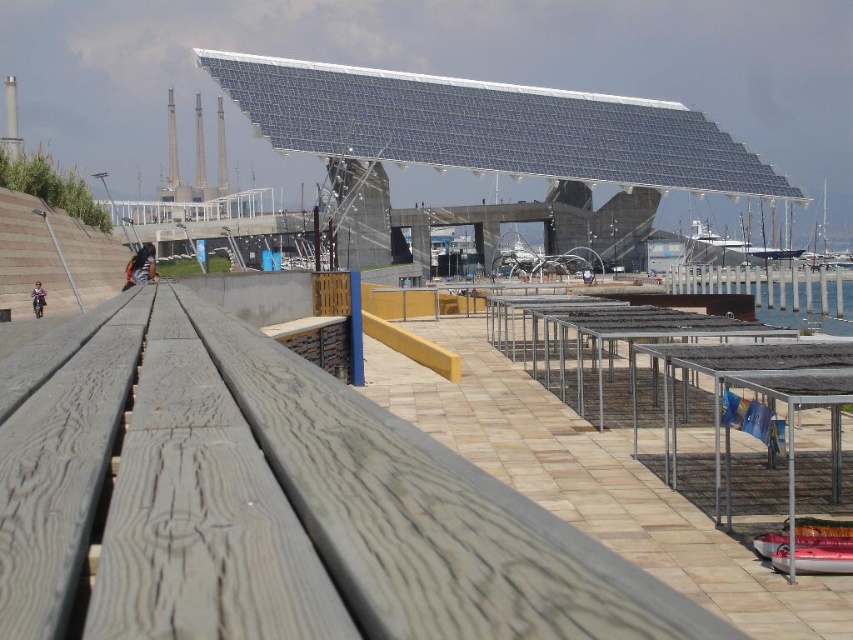
Who is lower down, weathered wood dock at center or clear water at lower right?

weathered wood dock at center is below.

Can you confirm if weathered wood dock at center is taller than clear water at lower right?

Incorrect, weathered wood dock at center's height is not larger of clear water at lower right's.

Where is `weathered wood dock at center`? The image size is (853, 640). weathered wood dock at center is located at coordinates (270, 502).